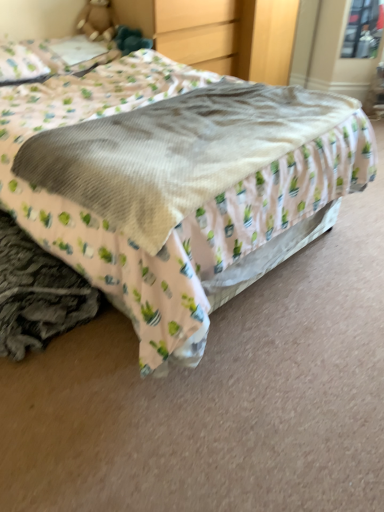
Question: Looking at their shapes, would you say transparent glass window at upper right is wider or thinner than matte wood dresser at upper center?

Choices:
 (A) thin
 (B) wide

Answer: (A)

Question: In terms of height, does transparent glass window at upper right look taller or shorter compared to matte wood dresser at upper center?

Choices:
 (A) short
 (B) tall

Answer: (A)

Question: Which object is the farthest from the matte wood dresser at upper center?

Choices:
 (A) transparent glass window at upper right
 (B) soft beige blanket at center
 (C) white fabric pillow at upper left

Answer: (B)

Question: Based on their relative distances, which object is nearer to the matte wood dresser at upper center?

Choices:
 (A) soft beige blanket at center
 (B) white fabric pillow at upper left
 (C) transparent glass window at upper right

Answer: (C)